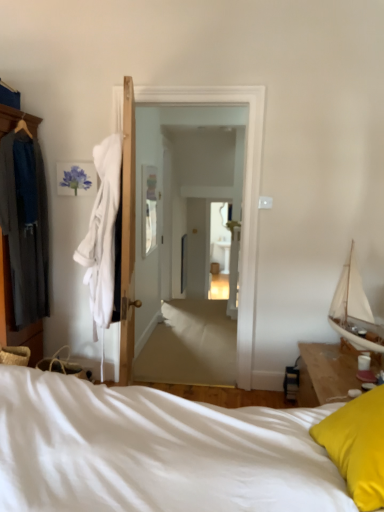
In order to click on blank space above white glossy door at center (from a real-world perspective) in this screenshot , I will do `click(187, 84)`.